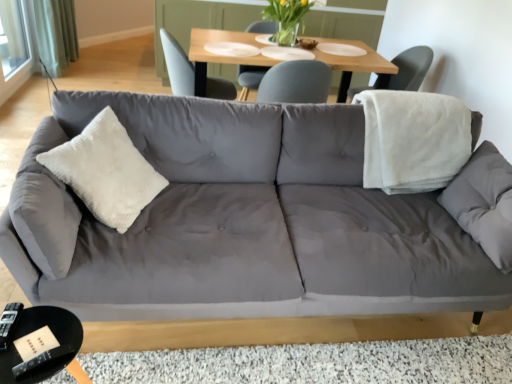
Question: Which is correct: gray fabric couch at center is inside translucent glass vase at upper center, or outside of it?

Choices:
 (A) outside
 (B) inside

Answer: (A)

Question: Relative to translucent glass vase at upper center, is gray fabric couch at center in front or behind?

Choices:
 (A) front
 (B) behind

Answer: (A)

Question: Which object is the closest to the black glossy coffee table at lower left?

Choices:
 (A) translucent glass vase at upper center
 (B) translucent glass vase at upper center
 (C) white textured chair at upper right, marked as the 1th chair in a right-to-left arrangement
 (D) white fleece blanket at right
 (E) transparent glass window screen at upper left

Answer: (D)

Question: Estimate the real-world distances between objects in this image. Which object is closer to the white textured chair at upper right, the second chair in the left-to-right sequence?

Choices:
 (A) translucent glass vase at upper center
 (B) wooden table at upper center
 (C) white corduroy pillow at center
 (D) translucent glass vase at upper center
 (E) white fleece blanket at right

Answer: (A)